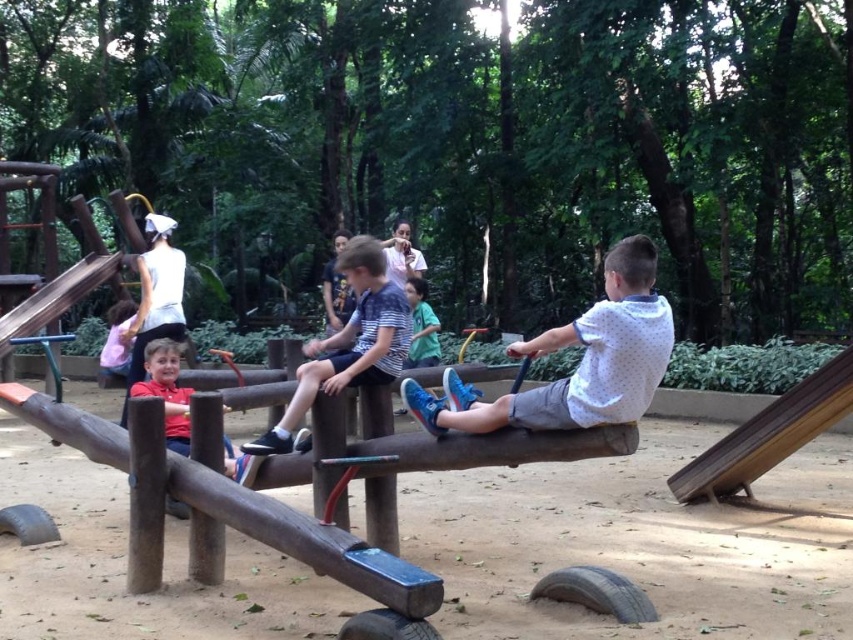
Is point (13, 321) farther from camera compared to point (408, 348)?

Yes, point (13, 321) is behind point (408, 348).

Describe the element at coordinates (55, 298) in the screenshot. I see `wooden slide at upper left` at that location.

Who is more distant from viewer, (3, 314) or (428, 316)?

The point (3, 314) is behind.

Locate an element on the screen. wooden slide at upper left is located at coordinates (55, 298).

Who is taller, wooden smooth slide at right or green matte shirt at center?

Standing taller between the two is wooden smooth slide at right.

Is wooden smooth slide at right above green matte shirt at center?

No, wooden smooth slide at right is not above green matte shirt at center.

Where is `wooden smooth slide at right`? The width and height of the screenshot is (853, 640). wooden smooth slide at right is located at coordinates (769, 435).

This screenshot has height=640, width=853. What do you see at coordinates (579, 362) in the screenshot?
I see `white dotted shirt at center` at bounding box center [579, 362].

Which of these two, white dotted shirt at center or green matte shirt at center, stands taller?

green matte shirt at center

This screenshot has height=640, width=853. In order to click on white dotted shirt at center in this screenshot , I will do `click(579, 362)`.